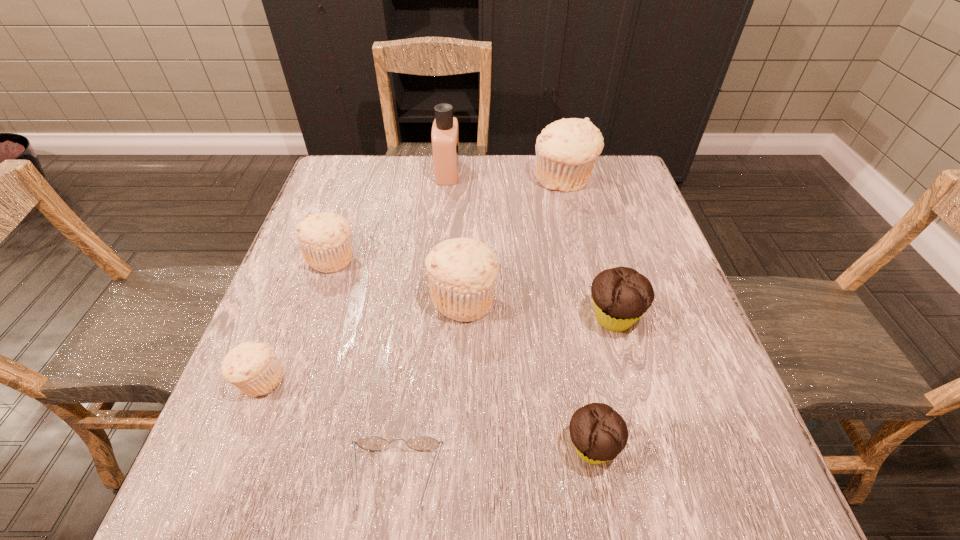
You are a GUI agent. You are given a task and a screenshot of the screen. Output one action in this format:
    pyautogui.click(x=<x>, y=<y>)
    Task: Click on the blank area in the image that satisfies the following two spatial constraints: 1. on the front label of the perfume; 2. on the right side of the farthest beige muffin
    This screenshot has height=540, width=960.
    Given the screenshot: What is the action you would take?
    pyautogui.click(x=446, y=180)